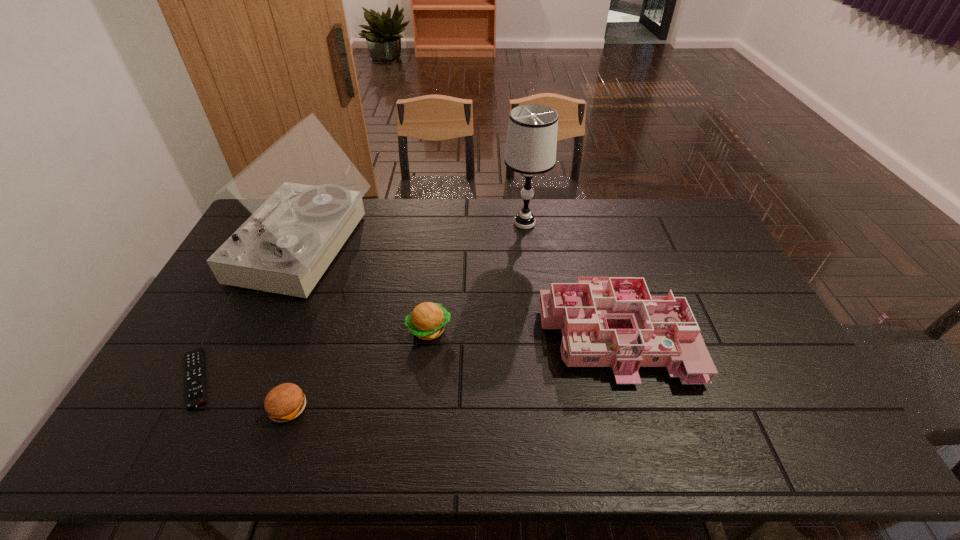
At what (x,y) coordinates should I click in order to perform the action: click on table lamp. Please return your answer as a coordinate pair (x, y). This screenshot has width=960, height=540. Looking at the image, I should click on (531, 143).

Locate an element on the screen. record player is located at coordinates (305, 195).

I want to click on dollhouse, so click(x=613, y=322).

Locate an element on the screen. The width and height of the screenshot is (960, 540). the farther hamburger is located at coordinates (427, 321).

The height and width of the screenshot is (540, 960). In order to click on the fourth tallest object in this screenshot , I will do `click(427, 321)`.

Identify the location of the nearer hamburger. This screenshot has height=540, width=960. click(x=285, y=402).

This screenshot has height=540, width=960. In order to click on the left hamburger in this screenshot , I will do `click(285, 402)`.

This screenshot has width=960, height=540. In order to click on the shortest object in this screenshot , I will do `click(195, 382)`.

This screenshot has width=960, height=540. I want to click on free location located on the front of the table lamp, so click(535, 306).

At what (x,y) coordinates should I click in order to perform the action: click on free point located 0.140m on the right of the record player. Please return your answer as a coordinate pair (x, y). This screenshot has width=960, height=540. Looking at the image, I should click on (408, 249).